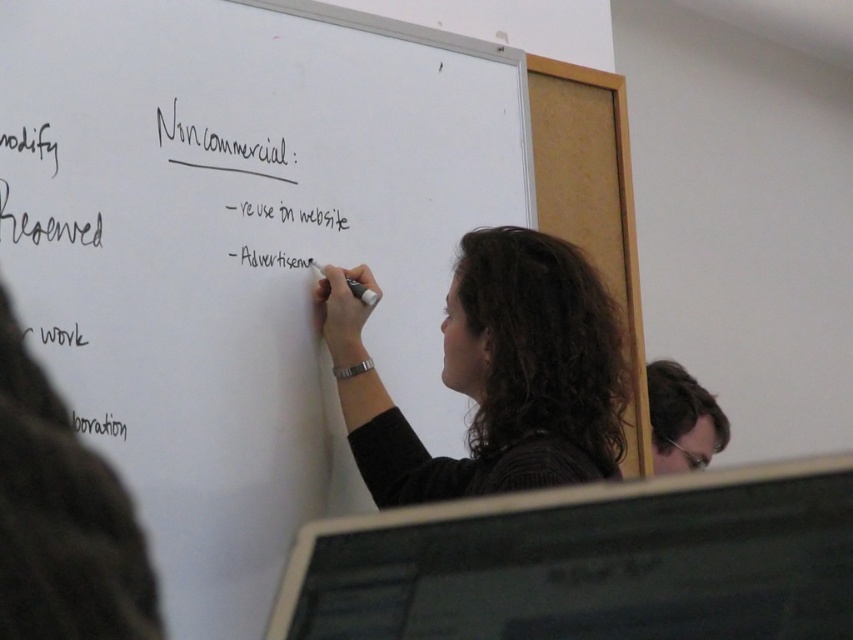
You are a student trying to reach the white matte board at center and the black marker at left. Which object is taller?

The white matte board at center is taller than the black marker at left.

You are a student sitting in the classroom. The teacher is writing on the whiteboard. You need to locate the point at coordinates (241, 248). Where would you find this point?

The point at coordinates (241, 248) is located on the white matte board at center.

You are standing in the classroom facing the whiteboard. There are two points marked on the whiteboard at coordinates point (454,168) and point (120,611). Which point is closer to you?

Point (120,611) is closer to you because it is in front of point (454,168).